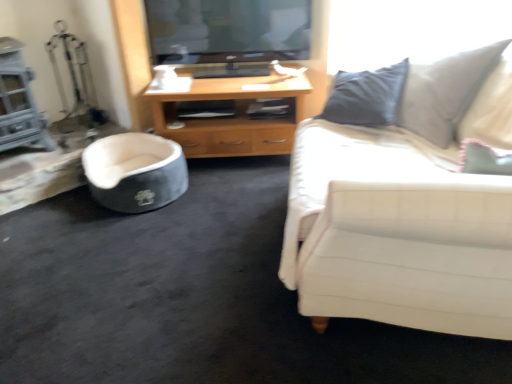
Question: Should I look upward or downward to see white fabric couch at right?

Choices:
 (A) down
 (B) up

Answer: (B)

Question: Is white fabric couch at right positioned behind soft gray fabric pet bed at lower left?

Choices:
 (A) no
 (B) yes

Answer: (A)

Question: Considering the relative sizes of white fabric couch at right and soft gray fabric pet bed at lower left in the image provided, is white fabric couch at right bigger than soft gray fabric pet bed at lower left?

Choices:
 (A) yes
 (B) no

Answer: (A)

Question: Can you confirm if white fabric couch at right is positioned to the left of soft gray fabric pet bed at lower left?

Choices:
 (A) yes
 (B) no

Answer: (B)

Question: Can we say white fabric couch at right lies outside soft gray fabric pet bed at lower left?

Choices:
 (A) yes
 (B) no

Answer: (A)

Question: From the image's perspective, is white fabric couch at right below soft gray fabric pet bed at lower left?

Choices:
 (A) yes
 (B) no

Answer: (B)

Question: Is white fabric couch at right far away from soft gray fabric pet bed at lower left?

Choices:
 (A) no
 (B) yes

Answer: (B)

Question: From a real-world perspective, does soft gray fabric pet bed at lower left stand above white fabric couch at right?

Choices:
 (A) no
 (B) yes

Answer: (A)

Question: From the image's perspective, is soft gray fabric pet bed at lower left located beneath white fabric couch at right?

Choices:
 (A) no
 (B) yes

Answer: (B)

Question: Considering the relative sizes of soft gray fabric pet bed at lower left and white fabric couch at right in the image provided, is soft gray fabric pet bed at lower left shorter than white fabric couch at right?

Choices:
 (A) yes
 (B) no

Answer: (A)

Question: Is soft gray fabric pet bed at lower left oriented towards white fabric couch at right?

Choices:
 (A) yes
 (B) no

Answer: (A)

Question: Does soft gray fabric pet bed at lower left come behind white fabric couch at right?

Choices:
 (A) yes
 (B) no

Answer: (A)

Question: Is soft gray fabric pet bed at lower left outside white fabric couch at right?

Choices:
 (A) yes
 (B) no

Answer: (A)

Question: Is the depth of white fabric couch at right less than that of wooden cabinet at center?

Choices:
 (A) no
 (B) yes

Answer: (B)